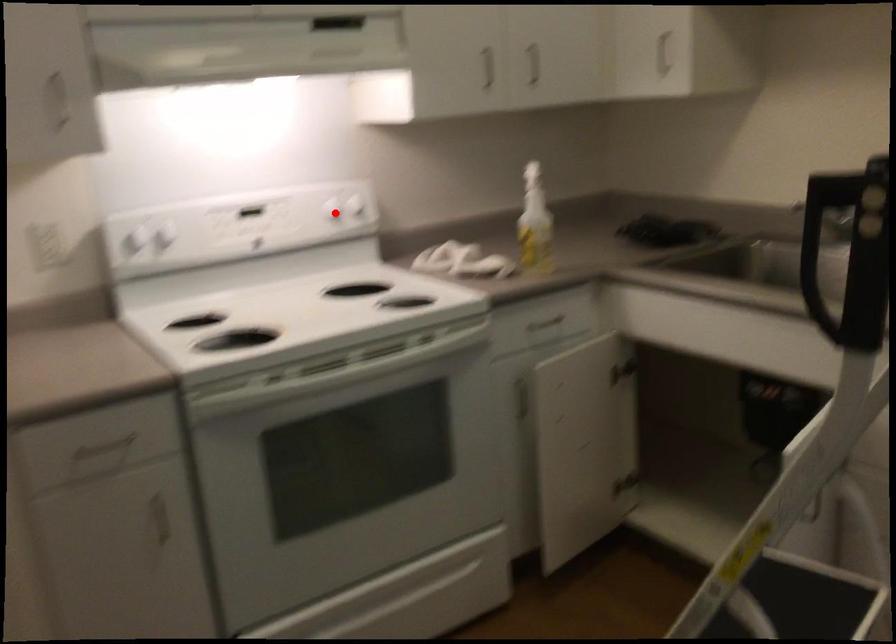
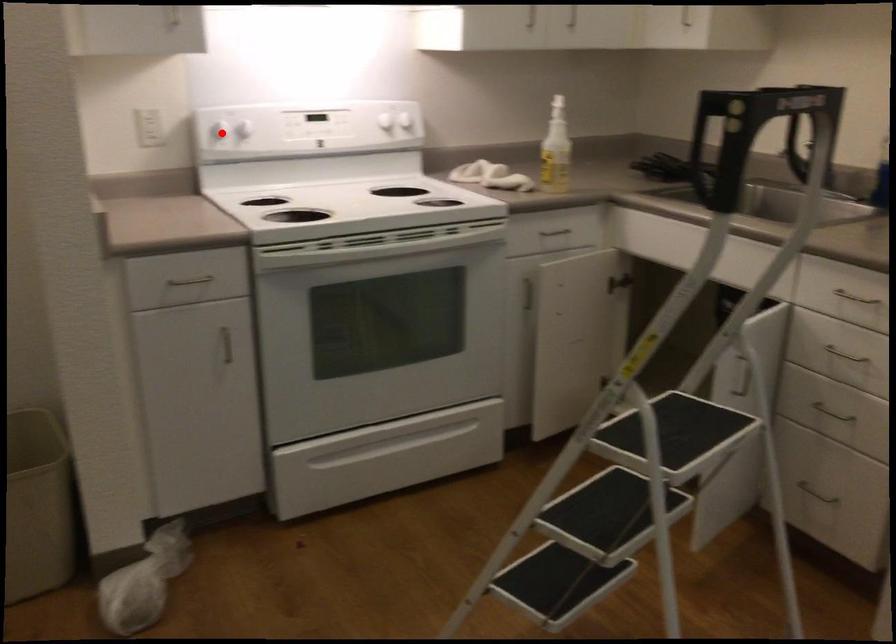
I am providing you with two images of the same scene from different viewpoints. A red point is marked on the first image and another point is marked on the second image. Are the points marked in image1 and image2 representing the same 3D position?

No